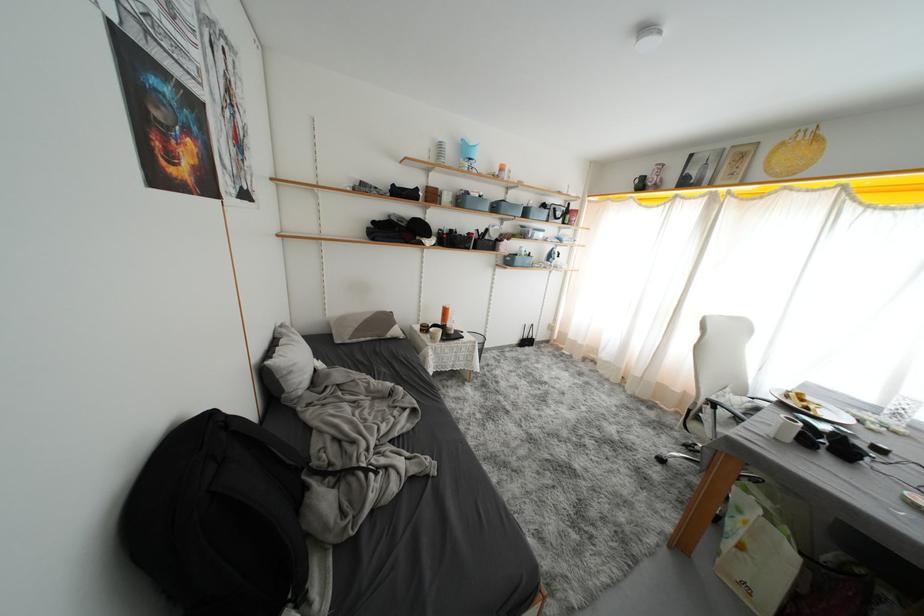
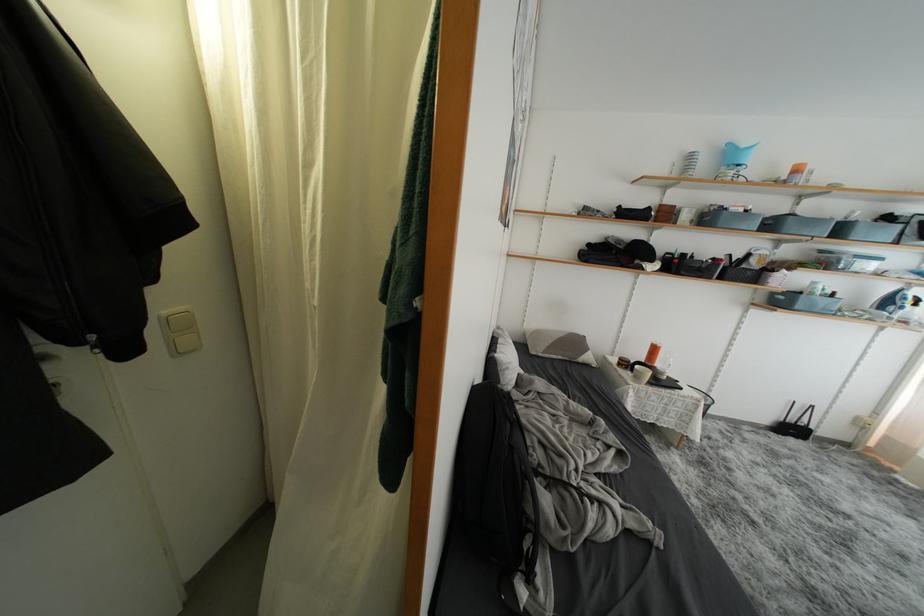
In the second image, find the point that corresponds to point 439,342 in the first image.

(642, 382)